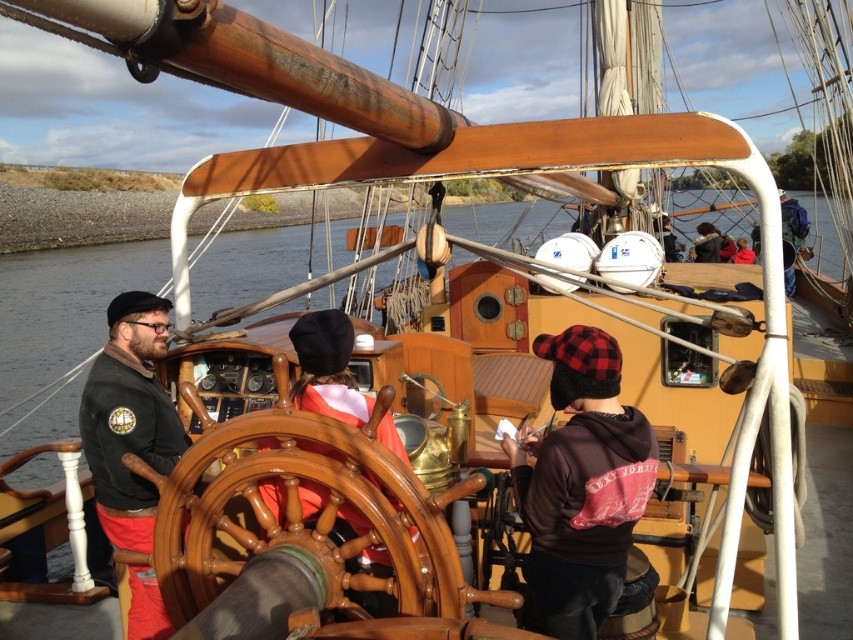
Looking at this image, you are a sailor on the deck of the schooner and need to store your belongings. You have a brown leather hat at center and a wooden helm at center. Which item can you place in a narrow storage compartment that is only 10 cm thick?

The brown leather hat at center is thinner than the wooden helm at center, so it can fit into the narrow storage compartment that is only 10 cm thick.

You are a sailor on the deck of the ship and need to adjust the sails. The shiny brown wooden wheel at center and the wooden helm at center are both in your view. Which object is shorter?

The shiny brown wooden wheel at center is shorter than the wooden helm at center.